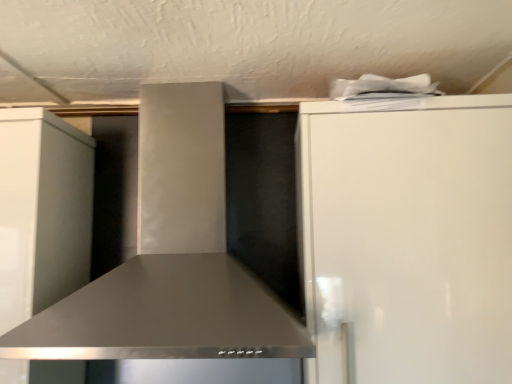
Question: From a real-world perspective, is satin black range hood at center physically located above or below white glossy refrigerator at upper right?

Choices:
 (A) above
 (B) below

Answer: (A)

Question: Is point (193, 152) positioned closer to the camera than point (368, 344)?

Choices:
 (A) closer
 (B) farther

Answer: (B)

Question: Is satin black range hood at center spatially inside white glossy refrigerator at upper right, or outside of it?

Choices:
 (A) inside
 (B) outside

Answer: (B)

Question: From a real-world perspective, relative to satin black range hood at center, is white glossy refrigerator at upper right vertically above or below?

Choices:
 (A) below
 (B) above

Answer: (A)

Question: From the image's perspective, relative to satin black range hood at center, is white glossy refrigerator at upper right above or below?

Choices:
 (A) above
 (B) below

Answer: (B)

Question: Which is correct: white glossy refrigerator at upper right is inside satin black range hood at center, or outside of it?

Choices:
 (A) outside
 (B) inside

Answer: (A)

Question: Is point (388, 380) positioned closer to the camera than point (53, 319)?

Choices:
 (A) farther
 (B) closer

Answer: (B)